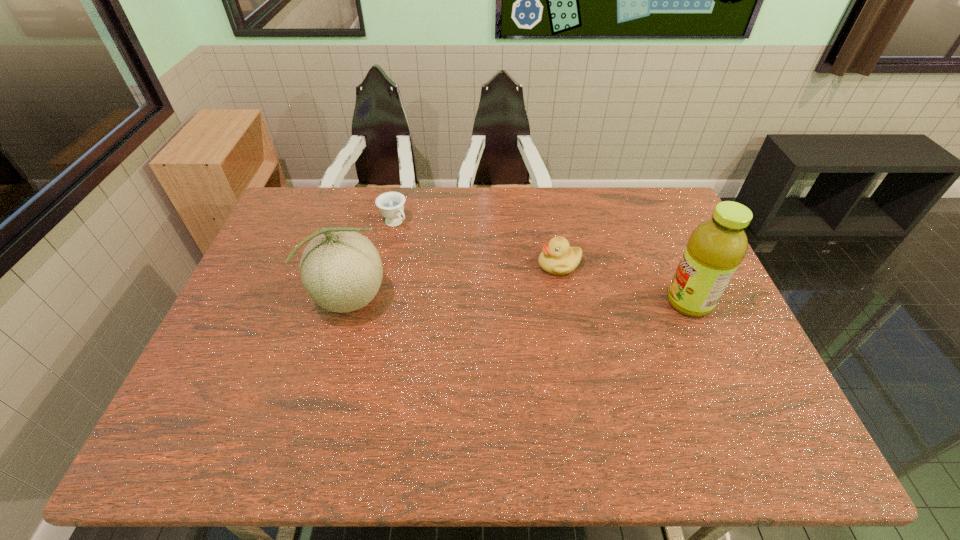
The image size is (960, 540). I want to click on the second closest object to the second shortest object, so click(391, 204).

You are a GUI agent. You are given a task and a screenshot of the screen. Output one action in this format:
    pyautogui.click(x=<x>, y=<y>)
    Task: Click on the object that is the third closest one to the cantaloup
    The height and width of the screenshot is (540, 960).
    Given the screenshot: What is the action you would take?
    pyautogui.click(x=716, y=247)

Find the location of a particular element. This screenshot has width=960, height=540. vacant space that satisfies the following two spatial constraints: 1. on the back side of the cantaloup; 2. on the right side of the third object from left to right is located at coordinates (362, 265).

Locate an element on the screen. The height and width of the screenshot is (540, 960). free space that satisfies the following two spatial constraints: 1. on the front side of the second object from right to left; 2. on the front label of the fruit juice is located at coordinates (565, 302).

Where is `vacant region that satisfies the following two spatial constraints: 1. on the front side of the rightmost object; 2. on the front label of the second object from right to left`? vacant region that satisfies the following two spatial constraints: 1. on the front side of the rightmost object; 2. on the front label of the second object from right to left is located at coordinates (565, 302).